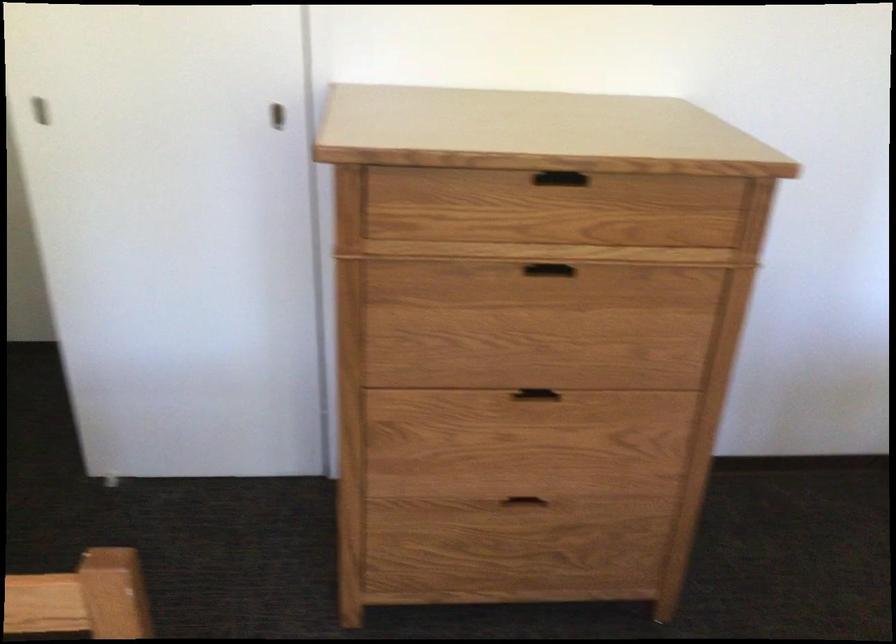
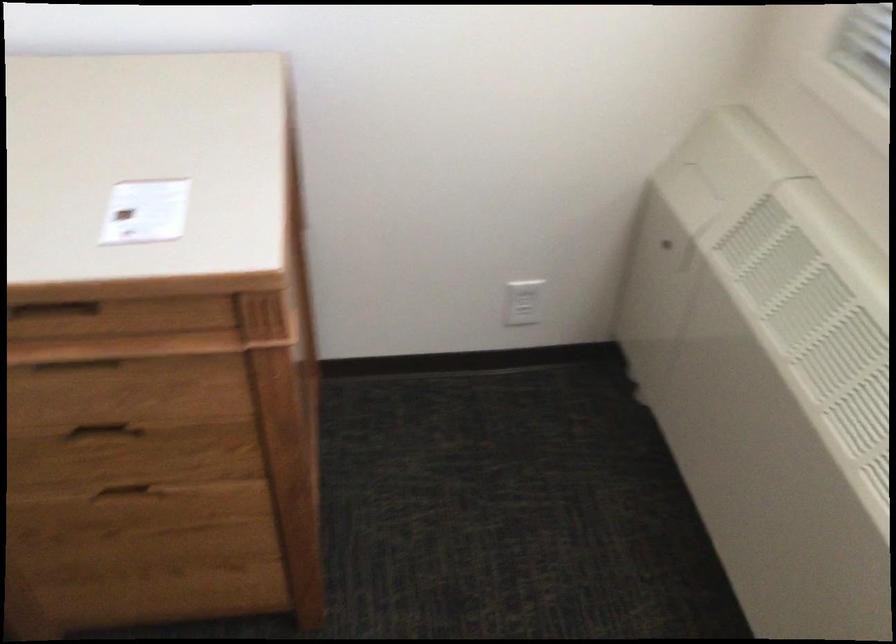
Consider the image. Based on the continuous images, in which direction is the camera rotating?

The rotation direction of the camera is right-down.